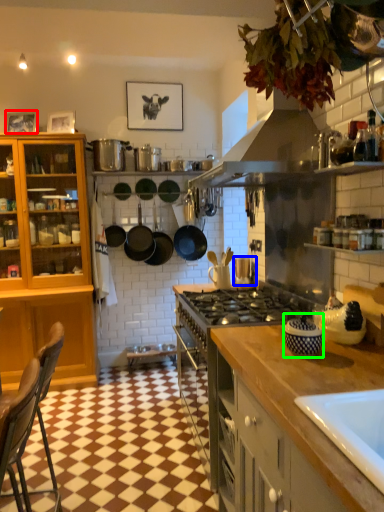
Question: Which object is the closest to the picture frame (highlighted by a red box)? Choose among these: appliance (highlighted by a blue box) or appliance (highlighted by a green box).

Choices:
 (A) appliance
 (B) appliance

Answer: (A)